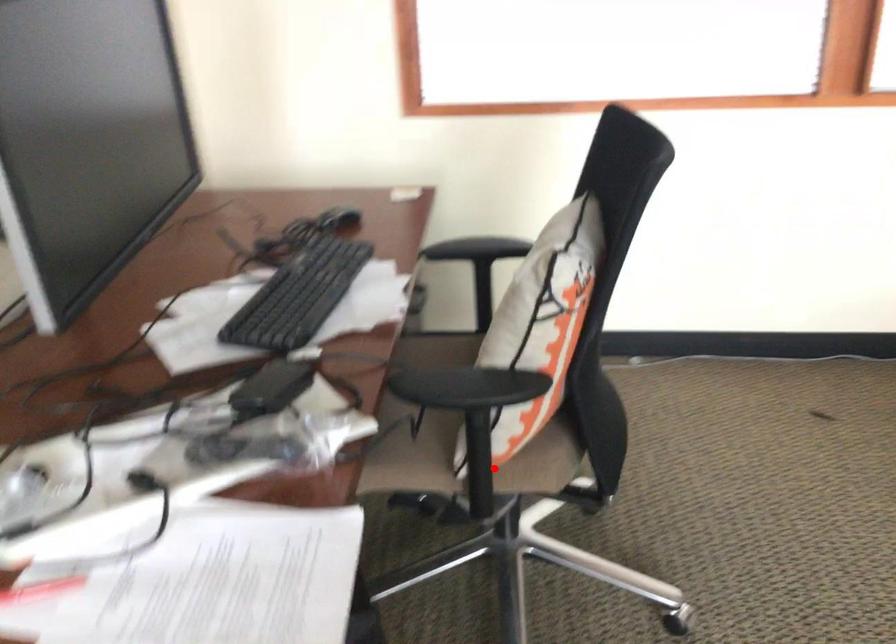
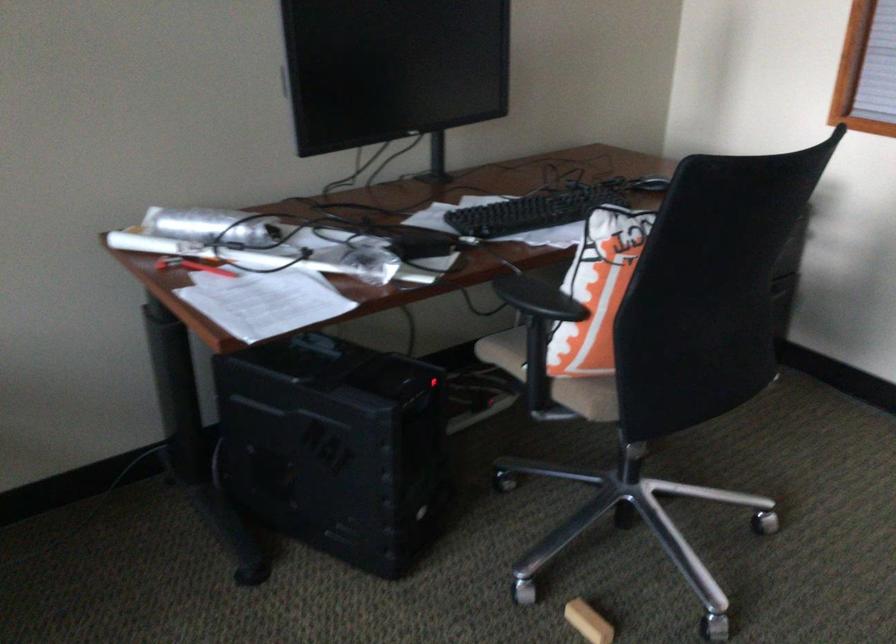
Question: I am providing you with two images of the same scene from different viewpoints. A red point is marked on the first image. Can you still see the location of the red point in image 2?

Choices:
 (A) Yes
 (B) No

Answer: (A)